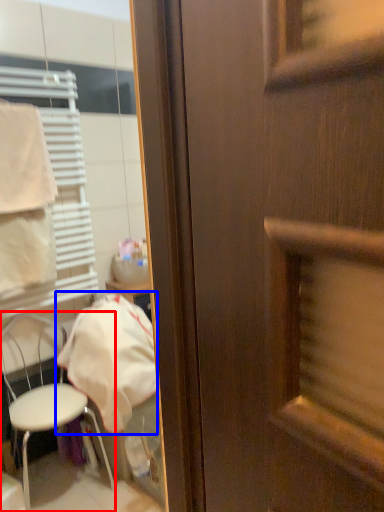
Question: Which point is closer to the camera, chair (highlighted by a red box) or cloth (highlighted by a blue box)?

Choices:
 (A) chair
 (B) cloth

Answer: (A)